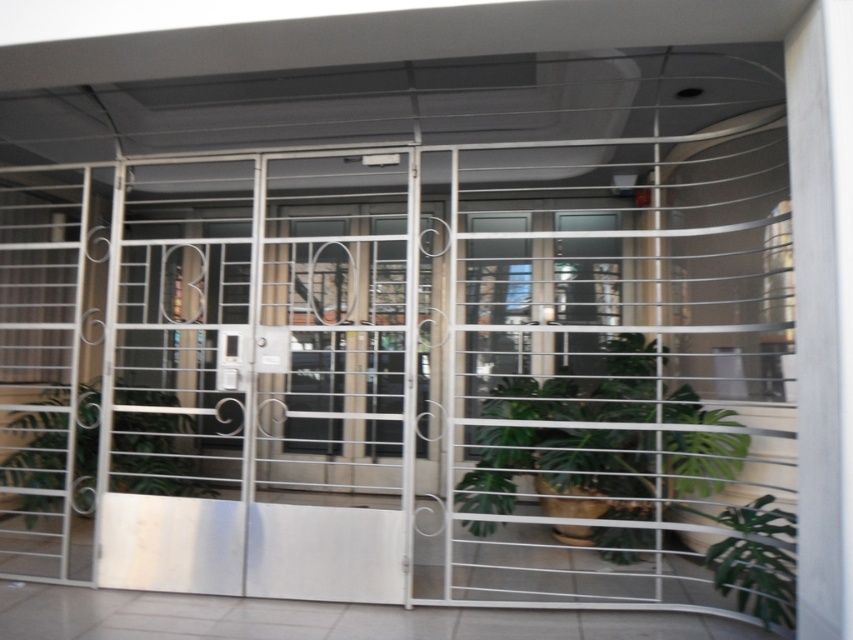
Question: Can you confirm if green leafy plant at center is wider than green leafy plant at lower left?

Choices:
 (A) yes
 (B) no

Answer: (A)

Question: Is green leafy plant at center smaller than green leafy plant at lower right?

Choices:
 (A) yes
 (B) no

Answer: (B)

Question: Is green leafy plant at center bigger than green leafy plant at lower right?

Choices:
 (A) yes
 (B) no

Answer: (A)

Question: Among these points, which one is nearest to the camera?

Choices:
 (A) (x=767, y=508)
 (B) (x=122, y=474)

Answer: (A)

Question: Which point is closer to the camera?

Choices:
 (A) green leafy plant at center
 (B) green leafy plant at lower left
 (C) green leafy plant at lower right

Answer: (C)

Question: Among these points, which one is nearest to the camera?

Choices:
 (A) (45, 442)
 (B) (714, 566)

Answer: (B)